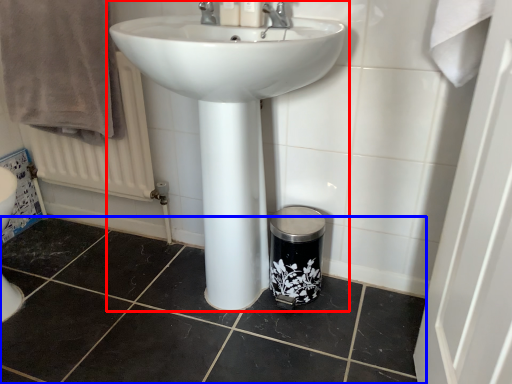
Question: Which point is closer to the camera, sink (highlighted by a red box) or tile (highlighted by a blue box)?

Choices:
 (A) sink
 (B) tile

Answer: (A)